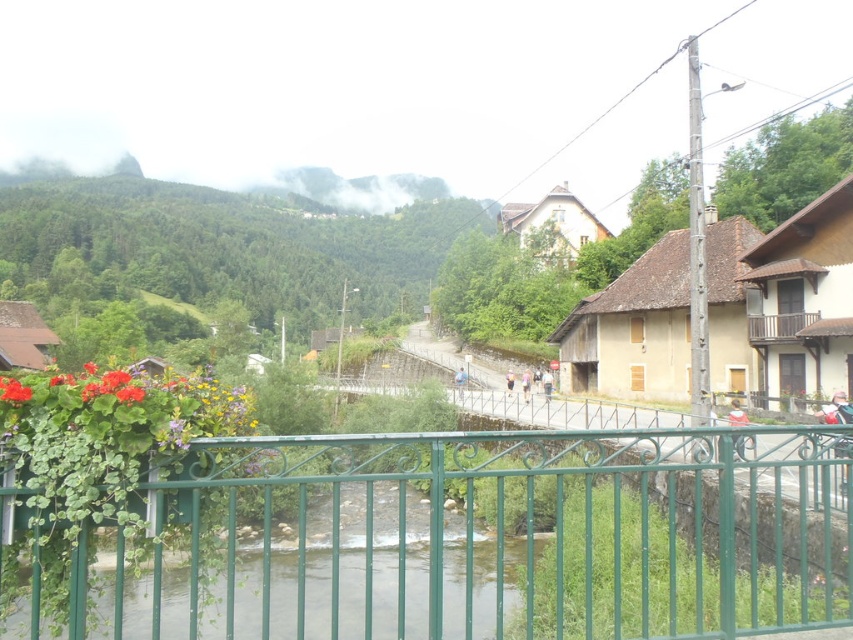
Question: Can you confirm if wooden house at center right is thinner than vivid red petals at lower left?

Choices:
 (A) yes
 (B) no

Answer: (B)

Question: Which object is closer to the camera taking this photo?

Choices:
 (A) brown wooden balcony at upper right
 (B) matte red flower at lower left

Answer: (B)

Question: Is green wrought iron fence at center below matte red flower at lower left?

Choices:
 (A) no
 (B) yes

Answer: (B)

Question: Does green metallic river at center have a lesser width compared to matte floral arrangement at left?

Choices:
 (A) no
 (B) yes

Answer: (A)

Question: Which object appears farthest from the camera in this image?

Choices:
 (A) green wrought iron fence at center
 (B) matte floral arrangement at left
 (C) green metallic river at center

Answer: (C)

Question: Which is farther from the green wrought iron fence at center?

Choices:
 (A) matte red flower at lower left
 (B) wooden house at center right
 (C) vivid red petals at lower left
 (D) green metallic river at center

Answer: (B)